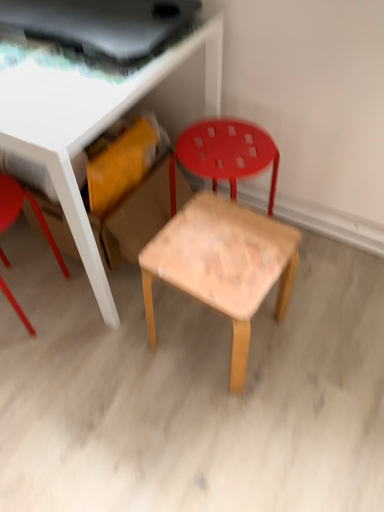
Locate an element on the screen. vacant space positioned to the left of natural wood stool at center is located at coordinates (112, 346).